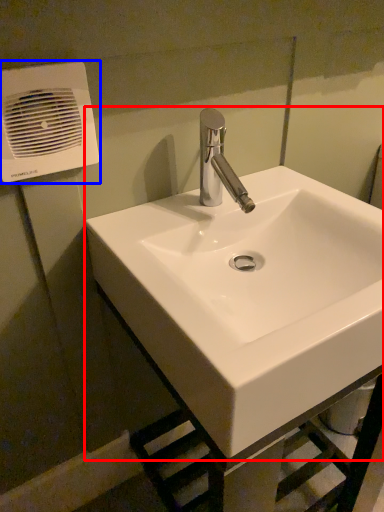
Question: Which point is further to the camera, sink (highlighted by a red box) or air conditioning (highlighted by a blue box)?

Choices:
 (A) sink
 (B) air conditioning

Answer: (B)